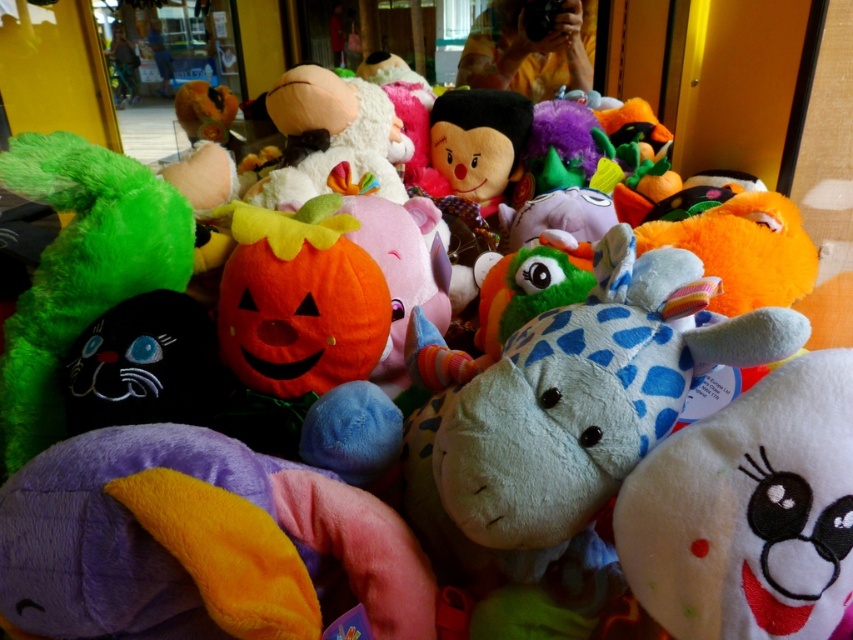
Question: Among these points, which one is farthest from the camera?

Choices:
 (A) 709,520
 (B) 283,124

Answer: (B)

Question: Which of the following is the closest to the observer?

Choices:
 (A) white soft plush at center
 (B) fluffy plush pumpkin at center

Answer: (A)

Question: Can you confirm if white soft plush at center is bigger than fluffy plush pumpkin at center?

Choices:
 (A) no
 (B) yes

Answer: (A)

Question: Is the position of white soft plush at center more distant than that of fluffy plush pumpkin at center?

Choices:
 (A) yes
 (B) no

Answer: (B)

Question: Where is white soft plush at center located in relation to fluffy plush pumpkin at center in the image?

Choices:
 (A) right
 (B) left

Answer: (A)